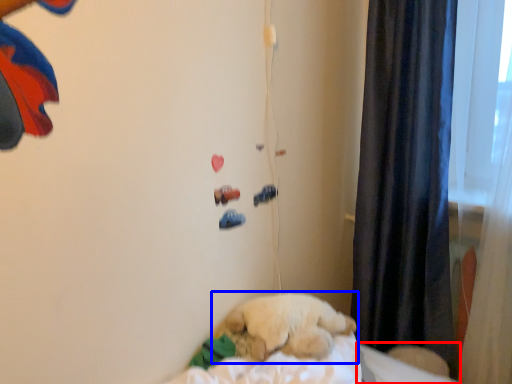
Question: Which of the following is the closest to the observer, sheet (highlighted by a red box) or dog (highlighted by a blue box)?

Choices:
 (A) sheet
 (B) dog

Answer: (B)